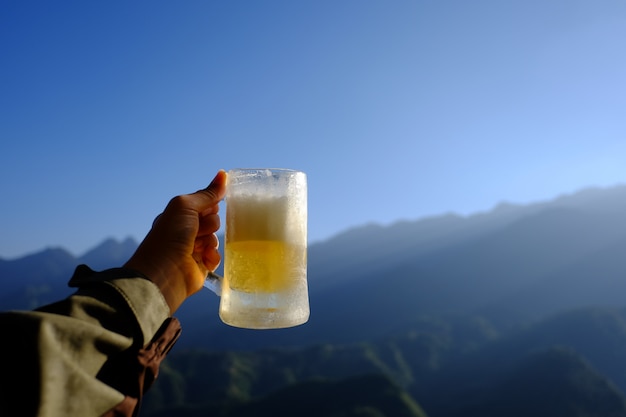
In order to click on mug in this screenshot , I will do `click(268, 198)`.